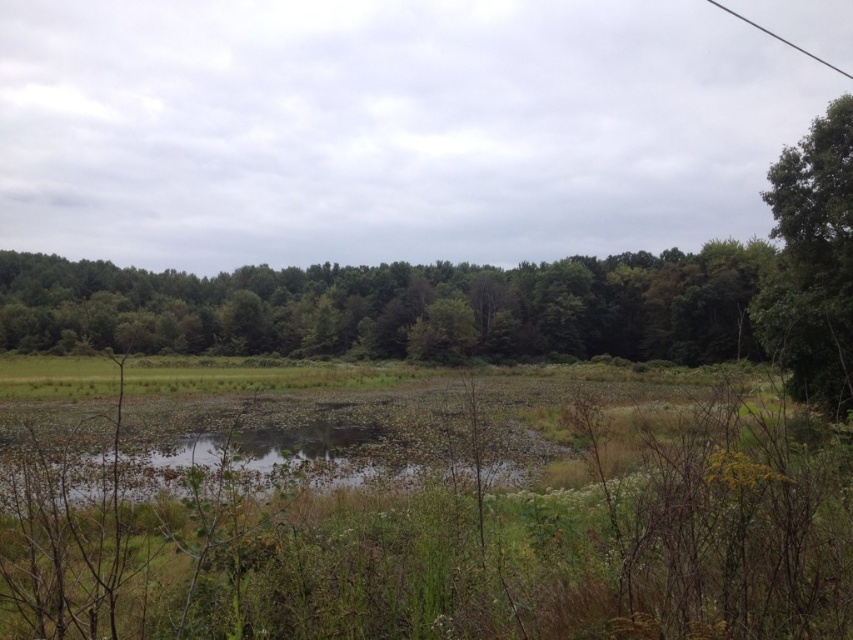
Which is more to the right, green leafy tree at center or green grassy lake at center?

From the viewer's perspective, green grassy lake at center appears more on the right side.

Is point (759, 248) closer to camera compared to point (360, 449)?

No, it is not.

Does point (640, 296) lie in front of point (396, 467)?

No, (640, 296) is behind (396, 467).

This screenshot has width=853, height=640. Identify the location of green leafy tree at center. (398, 307).

Can you confirm if green leafy tree at center is bigger than green leafy tree at right?

Yes.

Between green leafy tree at center and green leafy tree at right, which one has more height?

Standing taller between the two is green leafy tree at center.

Locate an element on the screen. The height and width of the screenshot is (640, 853). green leafy tree at center is located at coordinates (398, 307).

Locate an element on the screen. The height and width of the screenshot is (640, 853). green leafy tree at center is located at coordinates (398, 307).

Is green leafy tree at right taller than black wire at upper right?

No.

Can you confirm if green leafy tree at right is bigger than black wire at upper right?

Incorrect, green leafy tree at right is not larger than black wire at upper right.

Find the location of a particular element. This screenshot has height=640, width=853. green leafy tree at right is located at coordinates (811, 262).